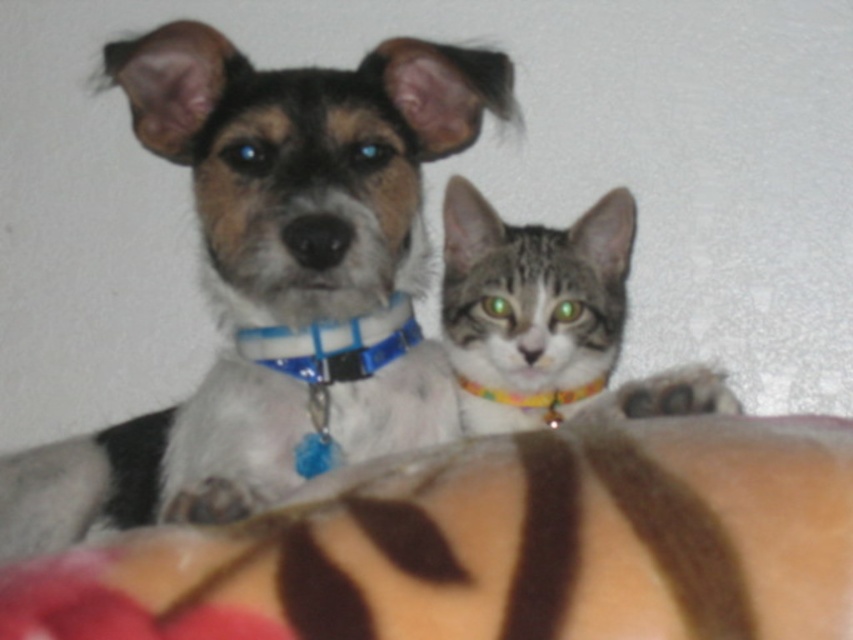
Question: Which is farther from the tabby fur cat at center?

Choices:
 (A) multicolored fabric neckband at center
 (B) blue plastic collar at center
 (C) shiny blue collar at center

Answer: (C)

Question: Does shiny blue collar at center have a greater width compared to blue plastic collar at center?

Choices:
 (A) yes
 (B) no

Answer: (A)

Question: Estimate the real-world distances between objects in this image. Which object is closer to the tabby fur cat at center?

Choices:
 (A) shiny blue collar at center
 (B) blue plastic collar at center
 (C) multicolored fabric neckband at center

Answer: (C)

Question: From the image, what is the correct spatial relationship of shiny blue collar at center in relation to blue plastic collar at center?

Choices:
 (A) below
 (B) above

Answer: (B)

Question: Does shiny blue collar at center have a greater width compared to multicolored fabric neckband at center?

Choices:
 (A) no
 (B) yes

Answer: (B)

Question: Which is nearer to the blue plastic collar at center?

Choices:
 (A) tabby fur cat at center
 (B) shiny blue collar at center

Answer: (B)